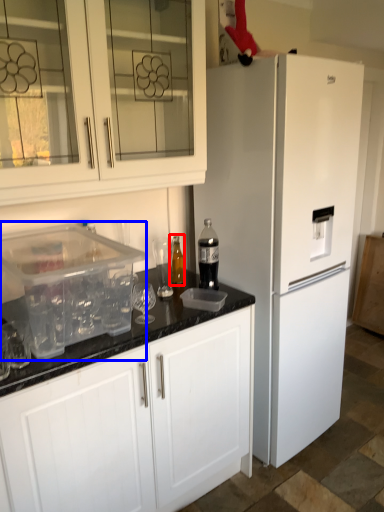
Question: Which point is further to the camera, bottle (highlighted by a red box) or appliance (highlighted by a blue box)?

Choices:
 (A) bottle
 (B) appliance

Answer: (A)